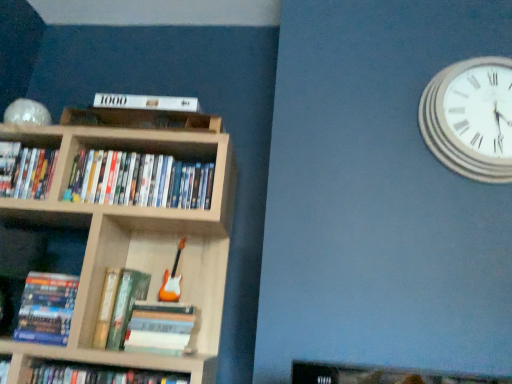
Question: From a real-world perspective, is wooden bookcase at center on top of matte black book at upper left, arranged as the first book when viewed from the left?

Choices:
 (A) no
 (B) yes

Answer: (A)

Question: Can you confirm if wooden bookcase at center is positioned to the right of matte black book at upper left, arranged as the first book when viewed from the left?

Choices:
 (A) no
 (B) yes

Answer: (B)

Question: Considering the relative positions of wooden bookcase at center and matte black book at upper left, arranged as the first book when viewed from the left, in the image provided, is wooden bookcase at center to the left of matte black book at upper left, arranged as the first book when viewed from the left, from the viewer's perspective?

Choices:
 (A) yes
 (B) no

Answer: (B)

Question: Can you confirm if wooden bookcase at center is smaller than matte black book at upper left, acting as the fifth book starting from the right?

Choices:
 (A) yes
 (B) no

Answer: (B)

Question: Is wooden bookcase at center next to matte black book at upper left, acting as the fifth book starting from the right?

Choices:
 (A) no
 (B) yes

Answer: (A)

Question: From the image's perspective, is hardcover book at lower left, the 2th book from the left, located above or below matte plastic dvds at center, acting as the fourth book starting from the left?

Choices:
 (A) above
 (B) below

Answer: (B)

Question: Considering the positions of hardcover book at lower left, the 2th book from the left, and matte plastic dvds at center, acting as the fourth book starting from the left, in the image, is hardcover book at lower left, the 2th book from the left, taller or shorter than matte plastic dvds at center, acting as the fourth book starting from the left,?

Choices:
 (A) tall
 (B) short

Answer: (A)

Question: Is point (28, 278) closer or farther from the camera than point (153, 155)?

Choices:
 (A) closer
 (B) farther

Answer: (A)

Question: In terms of width, does hardcover book at lower left, the fourth book in the right-to-left sequence, look wider or thinner when compared to matte plastic dvds at center, acting as the fourth book starting from the left?

Choices:
 (A) wide
 (B) thin

Answer: (B)

Question: In terms of height, does hardcover book at lower left, the 2th book from the left, look taller or shorter compared to wooden bookcase at center?

Choices:
 (A) tall
 (B) short

Answer: (B)

Question: Visually, is hardcover book at lower left, the fourth book in the right-to-left sequence, positioned to the left or to the right of wooden bookcase at center?

Choices:
 (A) left
 (B) right

Answer: (A)

Question: Is hardcover book at lower left, the 2th book from the left, in front of or behind wooden bookcase at center in the image?

Choices:
 (A) behind
 (B) front

Answer: (A)

Question: From a real-world perspective, is hardcover book at lower left, the fourth book in the right-to-left sequence, positioned above or below wooden bookcase at center?

Choices:
 (A) above
 (B) below

Answer: (B)

Question: Does point (106, 259) appear closer or farther from the camera than point (15, 228)?

Choices:
 (A) closer
 (B) farther

Answer: (A)

Question: In the image, is wooden bookcase at center positioned in front of or behind matte cardboard book at lower left?

Choices:
 (A) behind
 (B) front

Answer: (B)